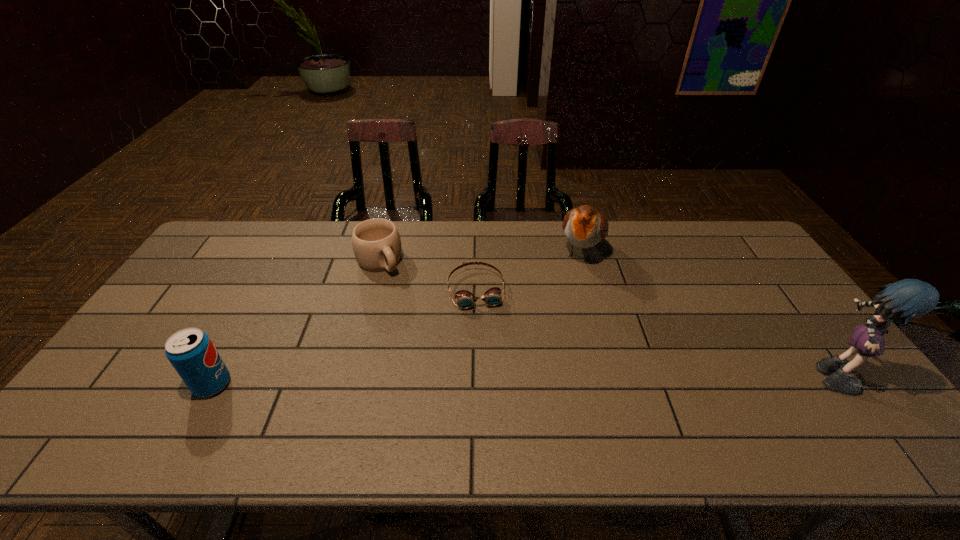
Identify the location of free space between the leftmost object and the bird. The width and height of the screenshot is (960, 540). (396, 318).

Where is `free space between the rightmost object and the fourth object from right to left`? The width and height of the screenshot is (960, 540). free space between the rightmost object and the fourth object from right to left is located at coordinates (605, 316).

Identify the location of free point between the shortest object and the fourth shortest object. (528, 271).

At what (x,y) coordinates should I click in order to perform the action: click on object that is the fourth closest to the soda can. Please return your answer as a coordinate pair (x, y). Looking at the image, I should click on (908, 299).

Point out which object is positioned as the fourth nearest to the second shortest object. Please provide its 2D coordinates. Your answer should be formatted as a tuple, i.e. [(x, y)], where the tuple contains the x and y coordinates of a point satisfying the conditions above.

[(908, 299)]

Where is `vacant space that satisfies the following two spatial constraints: 1. on the back side of the rag doll; 2. on the front-facing side of the soda can`? The width and height of the screenshot is (960, 540). vacant space that satisfies the following two spatial constraints: 1. on the back side of the rag doll; 2. on the front-facing side of the soda can is located at coordinates (219, 372).

Where is `vacant space that satisfies the following two spatial constraints: 1. on the front side of the rag doll; 2. on the front-facing side of the second object from left to right`? The image size is (960, 540). vacant space that satisfies the following two spatial constraints: 1. on the front side of the rag doll; 2. on the front-facing side of the second object from left to right is located at coordinates (348, 372).

In order to click on free point that satisfies the following two spatial constraints: 1. on the back side of the rag doll; 2. on the front-facing side of the third tallest object in this screenshot , I will do `click(219, 372)`.

At what (x,y) coordinates should I click in order to perform the action: click on free spot that satisfies the following two spatial constraints: 1. on the back side of the rightmost object; 2. on the front-facing side of the leftmost object. Please return your answer as a coordinate pair (x, y). The height and width of the screenshot is (540, 960). Looking at the image, I should click on (219, 372).